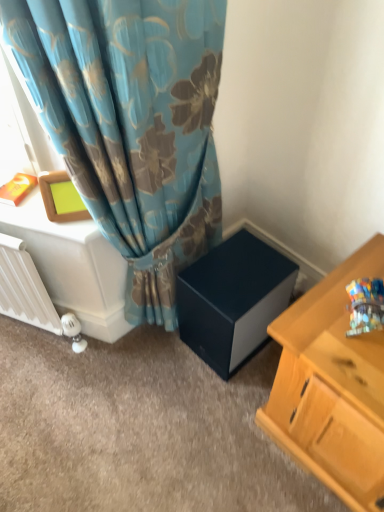
Locate an element on the screen. The height and width of the screenshot is (512, 384). blank area to the left of matte black cube at center is located at coordinates (161, 362).